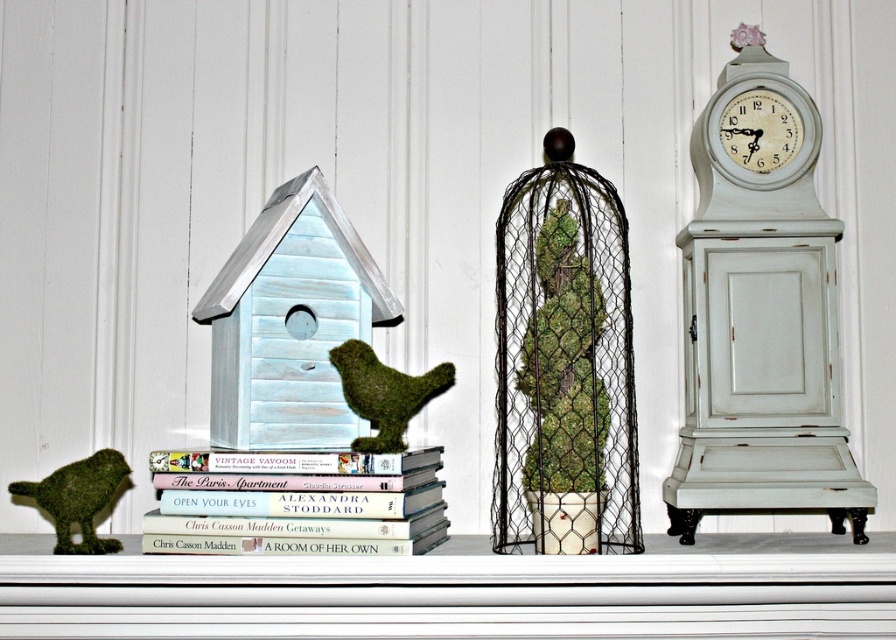
You are standing in front of the shelf and want to place a new item exactly at the center of the shelf. The shelf has a coordinate system where the bottom left corner is the origin point. The white distressed wood clock at right is located at coordinates 0.487, 0.849. Can you determine if the clock is positioned to the right or left of the shelf center?

The shelf center would be at coordinate (448, 320). The white distressed wood clock at right has coordinates (760, 310). Comparing the x coordinate, 0.487 is slightly less than 0.5, so the clock is positioned to the left of the shelf center.

You are standing in front of the shelf and want to place a new item exactly at the center of the shelf. The shelf is divided into three equal sections horizontally. The left section has the light blue birdhouse and mossy birds, the middle has a stack of books, and the right has the white distressed wood clock at right. Where should you place the new item to be at the exact center of the shelf?

The shelf is divided into three equal sections horizontally. The middle section contains the stack of books. Therefore, placing the new item in the middle section where the stack of books is located will position it at the exact center of the shelf.